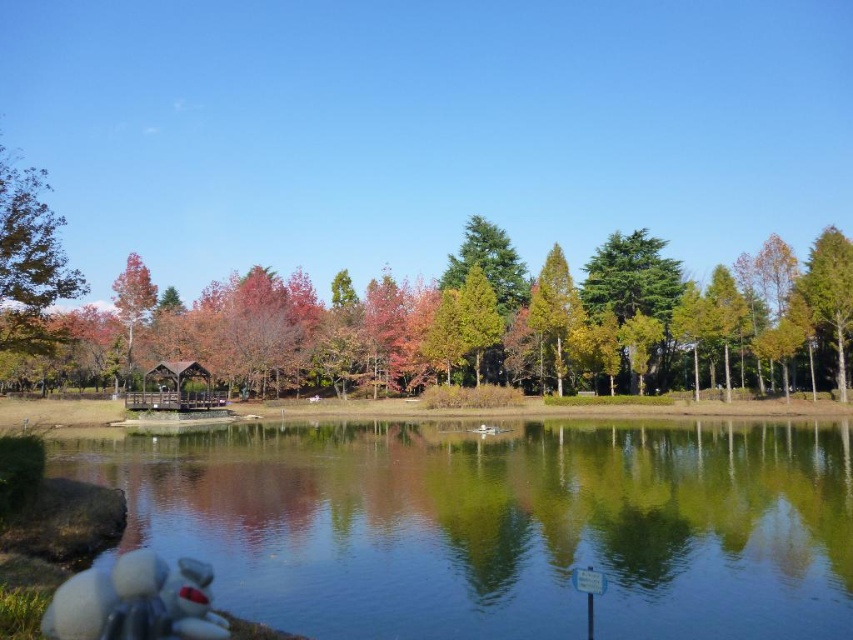
Describe the element at coordinates (500, 524) in the screenshot. The image size is (853, 640). I see `clear glass water at lower left` at that location.

Looking at this image, does clear glass water at lower left appear on the left side of green matte tree at upper left?

In fact, clear glass water at lower left is to the right of green matte tree at upper left.

Image resolution: width=853 pixels, height=640 pixels. I want to click on clear glass water at lower left, so click(x=500, y=524).

At what (x,y) coordinates should I click in order to perform the action: click on clear glass water at lower left. Please return your answer as a coordinate pair (x, y). The width and height of the screenshot is (853, 640). Looking at the image, I should click on (500, 524).

Does autumn leaves at center appear on the right side of green matte tree at right?

Incorrect, autumn leaves at center is not on the right side of green matte tree at right.

Is point (729, 314) closer to camera compared to point (834, 332)?

No, it is behind (834, 332).

At what (x,y) coordinates should I click in order to perform the action: click on autumn leaves at center. Please return your answer as a coordinate pair (x, y). Looking at the image, I should click on (476, 326).

Who is more forward, (x=22, y=291) or (x=833, y=273)?

Point (x=22, y=291) is more forward.

Looking at this image, does green matte tree at upper left have a larger size compared to green matte tree at right?

Yes.

Which is in front, point (33, 189) or point (822, 244)?

Positioned in front is point (33, 189).

You are a GUI agent. You are given a task and a screenshot of the screen. Output one action in this format:
    pyautogui.click(x=<x>, y=<y>)
    Task: Click on the green matte tree at upper left
    The width and height of the screenshot is (853, 640).
    Given the screenshot: What is the action you would take?
    pyautogui.click(x=30, y=262)